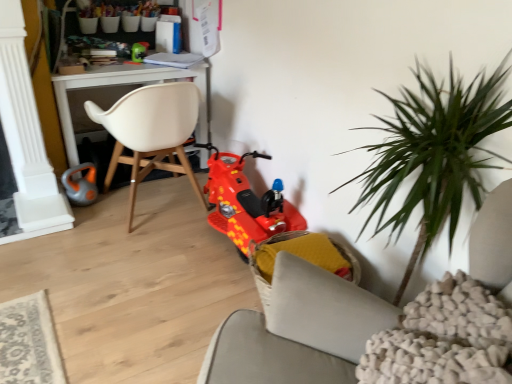
In order to click on vacant region to the left of shiny plastic scooter at center, placed as the first toy when sorted from right to left in this screenshot , I will do `click(157, 246)`.